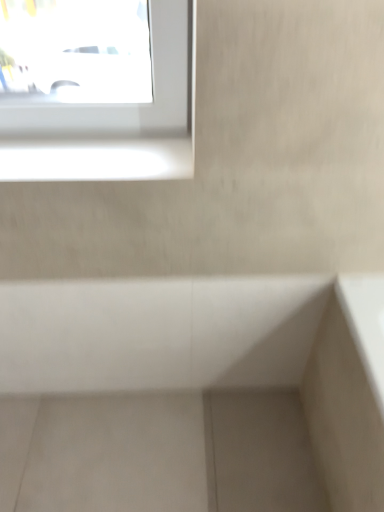
You are a GUI agent. You are given a task and a screenshot of the screen. Output one action in this format:
    pyautogui.click(x=<x>, y=<y>)
    Task: Click on the blank space situated above smooth concrete floor at lower center (from a real-world perspective)
    The image size is (384, 512).
    Given the screenshot: What is the action you would take?
    pyautogui.click(x=153, y=442)